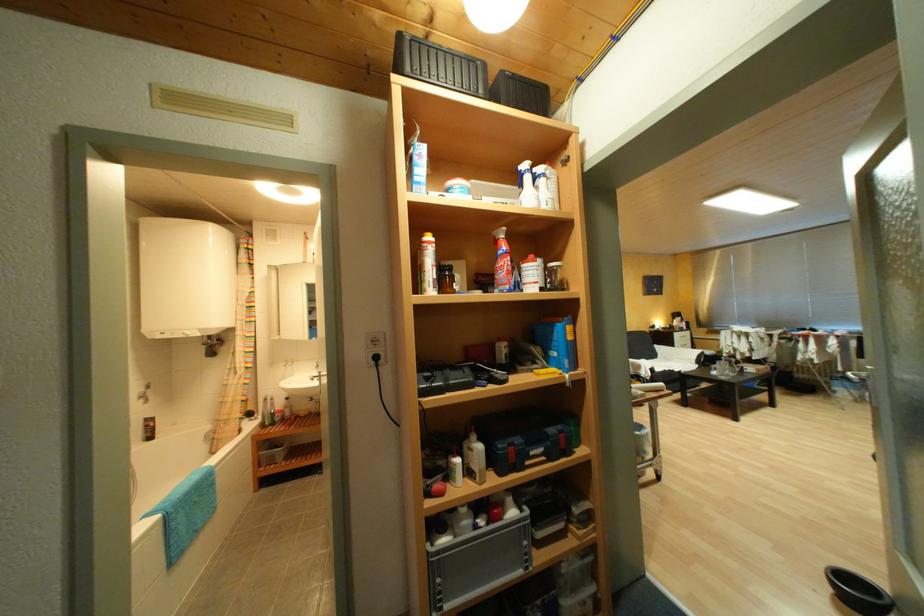
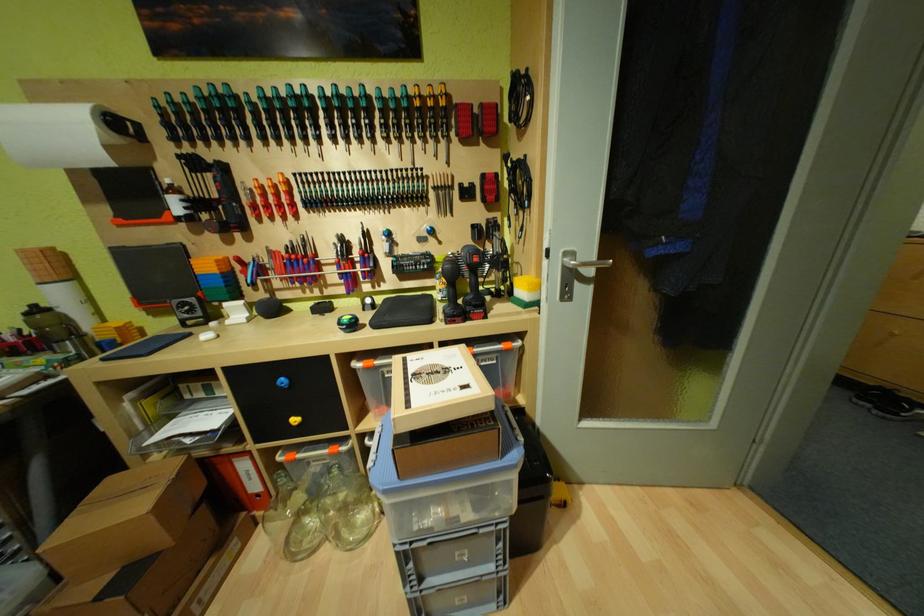
Question: I am providing you with two images of the same scene from different viewpoints. Which of the following objects are not visible in image2?

Choices:
 (A) orange sauce bottle
 (B) spray can nozzle
 (C) paper towel roll
 (D) blue lidded bin

Answer: (B)